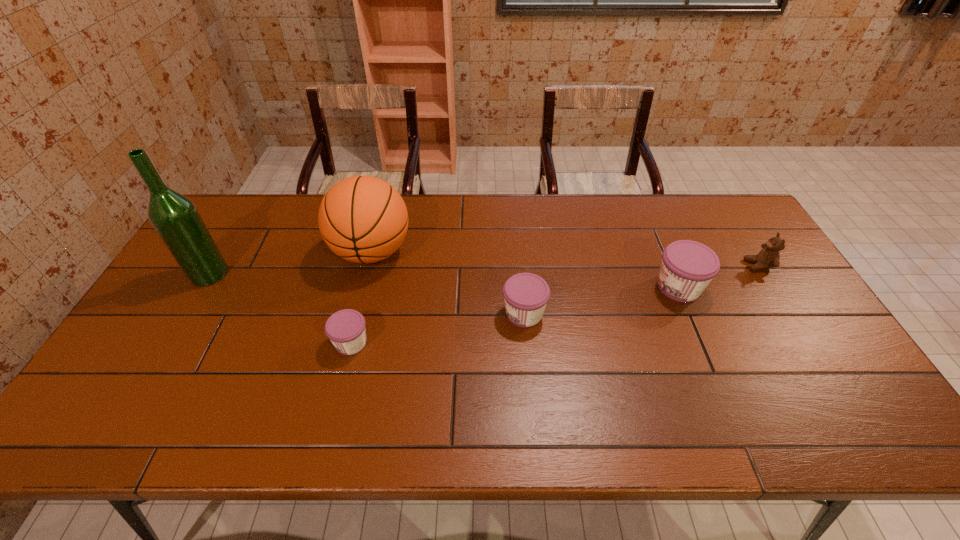
Image resolution: width=960 pixels, height=540 pixels. Find the location of `free spot located on the right of the second tallest object`. free spot located on the right of the second tallest object is located at coordinates 431,252.

This screenshot has width=960, height=540. What are the coordinates of `free spot located at the face of the teddy bear` in the screenshot? It's located at (644, 265).

Where is `blank space located 0.340m at the face of the teddy bear`? This screenshot has height=540, width=960. blank space located 0.340m at the face of the teddy bear is located at coordinates (635, 265).

Identify the location of vacant space located at the face of the teddy bear. (644, 265).

Where is `object present at the far edge`? This screenshot has width=960, height=540. object present at the far edge is located at coordinates (363, 219).

Locate an element on the screen. The image size is (960, 540). object situated at the left edge is located at coordinates (175, 218).

This screenshot has height=540, width=960. Find the location of `object situated at the right edge`. object situated at the right edge is located at coordinates (768, 257).

Locate an element on the screen. This screenshot has width=960, height=540. free location at the far edge of the desktop is located at coordinates (676, 218).

Where is `free spot at the near edge of the desktop`? Image resolution: width=960 pixels, height=540 pixels. free spot at the near edge of the desktop is located at coordinates (717, 390).

Where is `free space at the left edge of the desktop`? free space at the left edge of the desktop is located at coordinates (180, 333).